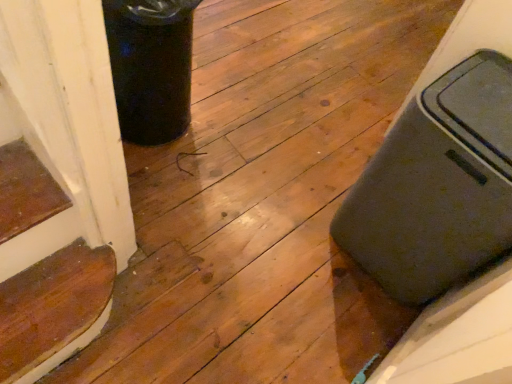
What do you see at coordinates (437, 185) in the screenshot?
I see `matte gray suitcase at right` at bounding box center [437, 185].

What is the approximate width of matte gray suitcase at right?

It is 16.62 inches.

At what (x,y) coordinates should I click in order to perform the action: click on matte gray suitcase at right. Please return your answer as a coordinate pair (x, y). This screenshot has width=512, height=384. Looking at the image, I should click on (437, 185).

Locate an element on the screen. Image resolution: width=512 pixels, height=384 pixels. wooden stair at lower left is located at coordinates (52, 305).

Describe the element at coordinates (52, 305) in the screenshot. The image size is (512, 384). I see `wooden stair at lower left` at that location.

Identify the location of matte gray suitcase at right. (437, 185).

Which is more to the right, wooden stair at lower left or matte gray suitcase at right?

matte gray suitcase at right.

Relative to matte gray suitcase at right, is wooden stair at lower left in front or behind?

Clearly, wooden stair at lower left is behind matte gray suitcase at right.

Considering the positions of point (40, 325) and point (426, 280), is point (40, 325) closer or farther from the camera than point (426, 280)?

Point (40, 325) appears to be closer to the viewer than point (426, 280).

From the image's perspective, between wooden stair at lower left and matte gray suitcase at right, who is located below?

wooden stair at lower left appears lower in the image.

From a real-world perspective, is wooden stair at lower left below matte gray suitcase at right?

Yes, from a real-world perspective, wooden stair at lower left is beneath matte gray suitcase at right.

Between wooden stair at lower left and matte gray suitcase at right, which one has smaller width?

wooden stair at lower left is thinner.

Does wooden stair at lower left have a greater height compared to matte gray suitcase at right?

No.

Who is smaller, wooden stair at lower left or matte gray suitcase at right?

wooden stair at lower left.

Would you say wooden stair at lower left contains matte gray suitcase at right?

Definitely not — matte gray suitcase at right is not inside wooden stair at lower left.

Is wooden stair at lower left next to matte gray suitcase at right and touching it?

No, wooden stair at lower left is not with matte gray suitcase at right.

Is wooden stair at lower left turned away from matte gray suitcase at right?

No, matte gray suitcase at right is not at the back of wooden stair at lower left.

I want to click on stairwell located underneath the matte gray suitcase at right (from a real-world perspective), so [52, 305].

Considering the positions of objects matte gray suitcase at right and wooden stair at lower left in the image provided, who is more to the right, matte gray suitcase at right or wooden stair at lower left?

From the viewer's perspective, matte gray suitcase at right appears more on the right side.

Does matte gray suitcase at right lie in front of wooden stair at lower left?

Yes.

Considering the positions of point (474, 179) and point (22, 340), is point (474, 179) closer or farther from the camera than point (22, 340)?

Point (474, 179) appears to be closer to the viewer than point (22, 340).

From the image's perspective, is matte gray suitcase at right below wooden stair at lower left?

Actually, matte gray suitcase at right appears above wooden stair at lower left in the image.

From a real-world perspective, which object stands above the other?

In real-world perspective, matte gray suitcase at right is above.

Is matte gray suitcase at right thinner than wooden stair at lower left?

In fact, matte gray suitcase at right might be wider than wooden stair at lower left.

Considering the sizes of matte gray suitcase at right and wooden stair at lower left in the image, is matte gray suitcase at right taller or shorter than wooden stair at lower left?

Clearly, matte gray suitcase at right is taller compared to wooden stair at lower left.

Considering the sizes of objects matte gray suitcase at right and wooden stair at lower left in the image provided, who is smaller, matte gray suitcase at right or wooden stair at lower left?

wooden stair at lower left is smaller.

Is matte gray suitcase at right not inside wooden stair at lower left?

Indeed, matte gray suitcase at right is completely outside wooden stair at lower left.

Is matte gray suitcase at right far from wooden stair at lower left?

They are positioned close to each other.

Is matte gray suitcase at right facing away from wooden stair at lower left?

No, matte gray suitcase at right is not facing away from wooden stair at lower left.

Can you tell me how much matte gray suitcase at right and wooden stair at lower left differ in facing direction?

180 degrees.

The width and height of the screenshot is (512, 384). I want to click on stairwell beneath the matte gray suitcase at right (from a real-world perspective), so click(52, 305).

Locate an element on the screen. The image size is (512, 384). waste container in front of the wooden stair at lower left is located at coordinates (437, 185).

At what (x,y) coordinates should I click in order to perform the action: click on stairwell beneath the matte gray suitcase at right (from a real-world perspective). Please return your answer as a coordinate pair (x, y). The width and height of the screenshot is (512, 384). Looking at the image, I should click on (52, 305).